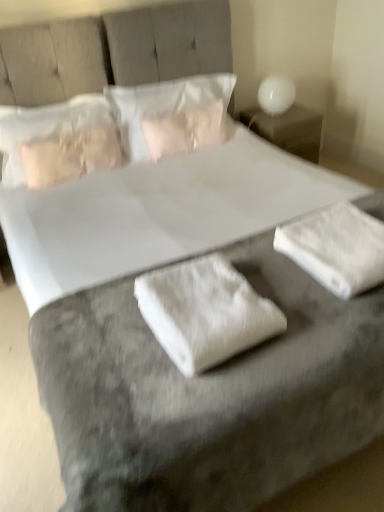
Question: Considering the relative sizes of white fabric at center, positioned as the first material in left-to-right order, and white fluffy towel at lower right, positioned as the first material in right-to-left order, in the image provided, is white fabric at center, positioned as the first material in left-to-right order, wider than white fluffy towel at lower right, positioned as the first material in right-to-left order,?

Choices:
 (A) no
 (B) yes

Answer: (B)

Question: Is white fabric at center, the second material positioned from the right, bigger than white fluffy towel at lower right, arranged as the second material when viewed from the left?

Choices:
 (A) no
 (B) yes

Answer: (B)

Question: Does white fabric at center, positioned as the first material in left-to-right order, turn towards white fluffy towel at lower right, positioned as the first material in right-to-left order?

Choices:
 (A) yes
 (B) no

Answer: (B)

Question: Is white fabric at center, positioned as the first material in left-to-right order, located outside white fluffy towel at lower right, arranged as the second material when viewed from the left?

Choices:
 (A) no
 (B) yes

Answer: (B)

Question: From a real-world perspective, is white fabric at center, positioned as the first material in left-to-right order, located higher than white fluffy towel at lower right, arranged as the second material when viewed from the left?

Choices:
 (A) yes
 (B) no

Answer: (A)

Question: In terms of width, does white fabric at center, the second material positioned from the right, look wider or thinner when compared to satin beige pillow at upper left, placed as the 2th pillow when sorted from right to left?

Choices:
 (A) thin
 (B) wide

Answer: (B)

Question: Considering the relative positions of white fabric at center, the second material positioned from the right, and satin beige pillow at upper left, placed as the 2th pillow when sorted from right to left, in the image provided, is white fabric at center, the second material positioned from the right, to the left or to the right of satin beige pillow at upper left, placed as the 2th pillow when sorted from right to left,?

Choices:
 (A) left
 (B) right

Answer: (B)

Question: Considering the positions of white fabric at center, the second material positioned from the right, and satin beige pillow at upper left, placed as the 2th pillow when sorted from right to left, in the image, is white fabric at center, the second material positioned from the right, bigger or smaller than satin beige pillow at upper left, placed as the 2th pillow when sorted from right to left,?

Choices:
 (A) small
 (B) big

Answer: (A)

Question: Relative to satin beige pillow at upper left, the first pillow viewed from the left, is white fabric at center, positioned as the first material in left-to-right order, in front or behind?

Choices:
 (A) behind
 (B) front

Answer: (B)

Question: In terms of width, does white fabric at center, the second material positioned from the right, look wider or thinner when compared to white glossy table lamp at upper right?

Choices:
 (A) thin
 (B) wide

Answer: (B)

Question: Is point (220, 326) positioned closer to the camera than point (283, 76)?

Choices:
 (A) closer
 (B) farther

Answer: (A)

Question: Is white fabric at center, the second material positioned from the right, taller or shorter than white glossy table lamp at upper right?

Choices:
 (A) short
 (B) tall

Answer: (A)

Question: Choose the correct answer: Is white fabric at center, the second material positioned from the right, inside white glossy table lamp at upper right or outside it?

Choices:
 (A) inside
 (B) outside

Answer: (B)

Question: In terms of size, does white glossy nightstand at upper right appear bigger or smaller than white fluffy towel at lower right, arranged as the second material when viewed from the left?

Choices:
 (A) small
 (B) big

Answer: (B)

Question: From the image's perspective, is white glossy nightstand at upper right above or below white fluffy towel at lower right, arranged as the second material when viewed from the left?

Choices:
 (A) below
 (B) above

Answer: (B)